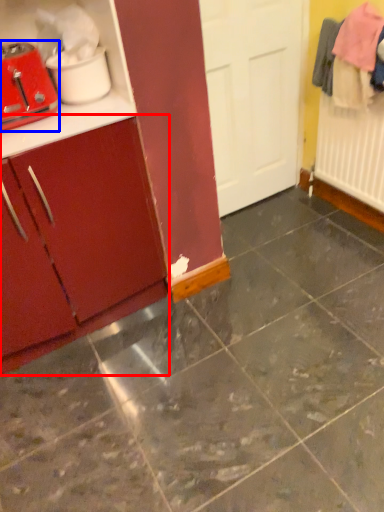
Question: Which object appears closest to the camera in this image, cabinetry (highlighted by a red box) or toaster (highlighted by a blue box)?

Choices:
 (A) cabinetry
 (B) toaster

Answer: (A)